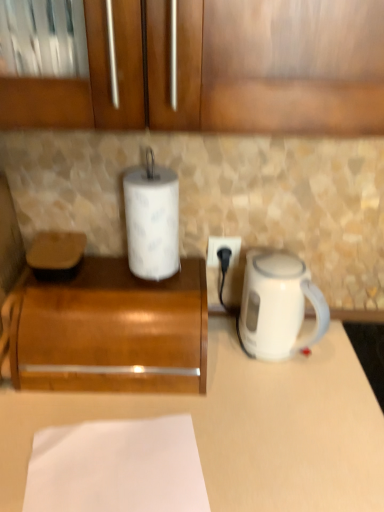
Identify the location of empty space that is ontop of wooden at left (from a real-world perspective). (115, 287).